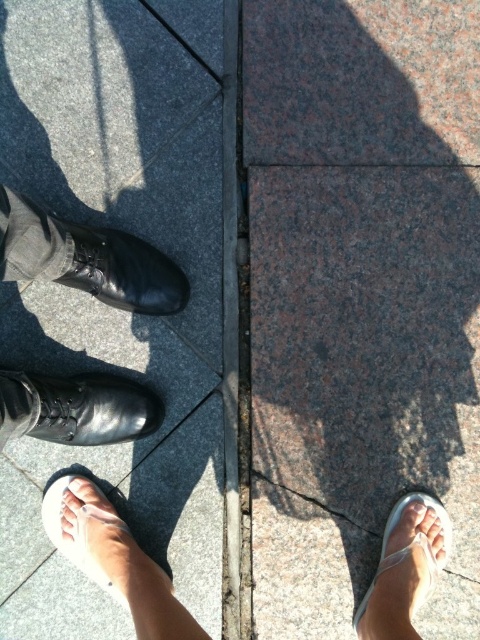
Can you confirm if shiny black shoe at lower left is wider than black leather shoe at left?

Indeed, shiny black shoe at lower left has a greater width compared to black leather shoe at left.

Is point (140, 401) positioned after point (85, 252)?

Yes, it is.

Where is `shiny black shoe at lower left`? The width and height of the screenshot is (480, 640). shiny black shoe at lower left is located at coordinates (76, 408).

What do you see at coordinates (123, 269) in the screenshot?
I see `black leather shoe at left` at bounding box center [123, 269].

Between point (82, 284) and point (99, 500), which one is positioned behind?

The point (99, 500) is behind.

Locate an element on the screen. This screenshot has width=480, height=640. black leather shoe at left is located at coordinates (123, 269).

Between white fabric sandal at lower right and white fabric sandal at lower left, which one appears on the right side from the viewer's perspective?

white fabric sandal at lower right

Is white fabric sandal at lower right bigger than white fabric sandal at lower left?

No.

The height and width of the screenshot is (640, 480). What are the coordinates of `white fabric sandal at lower right` in the screenshot? It's located at (405, 566).